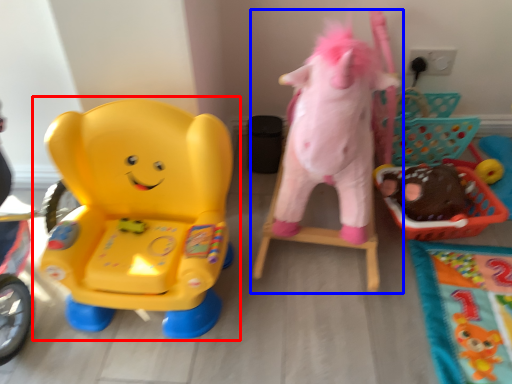
Question: Which object appears closest to the camera in this image, toy (highlighted by a red box) or toy (highlighted by a blue box)?

Choices:
 (A) toy
 (B) toy

Answer: (B)